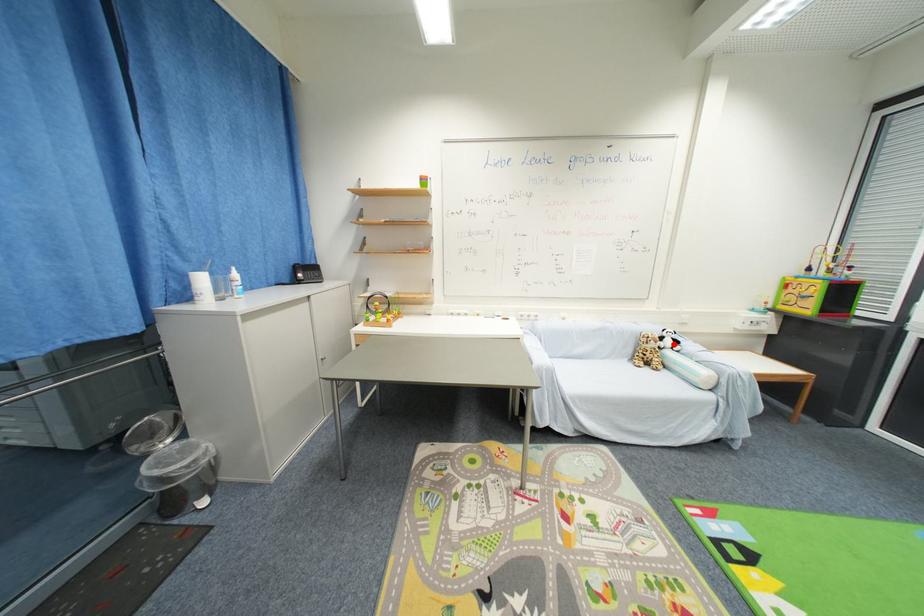
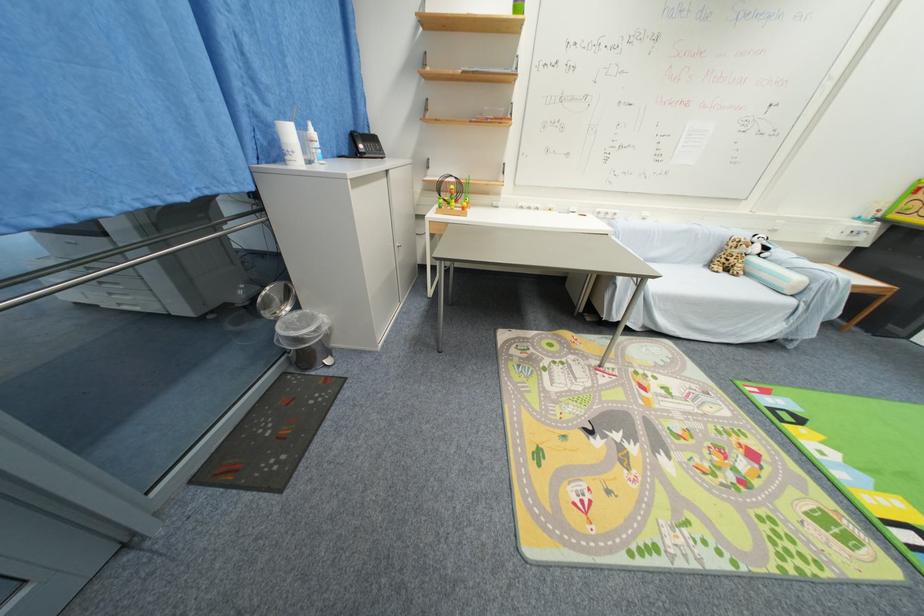
Where in the second image is the point corresponding to the highlighted location from the first image?

(761, 251)